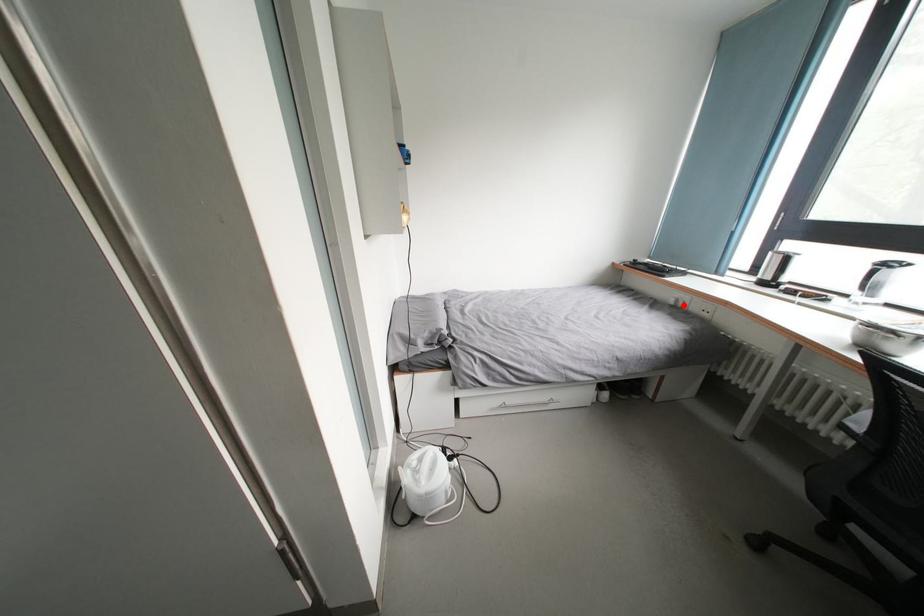
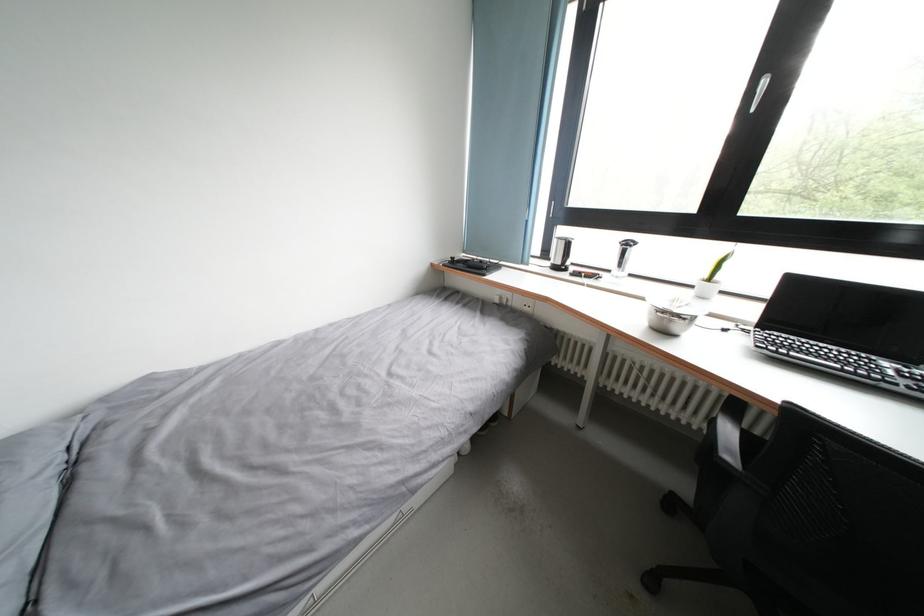
Find the pixel in the second image that matches the highlighted location in the first image.

(507, 302)